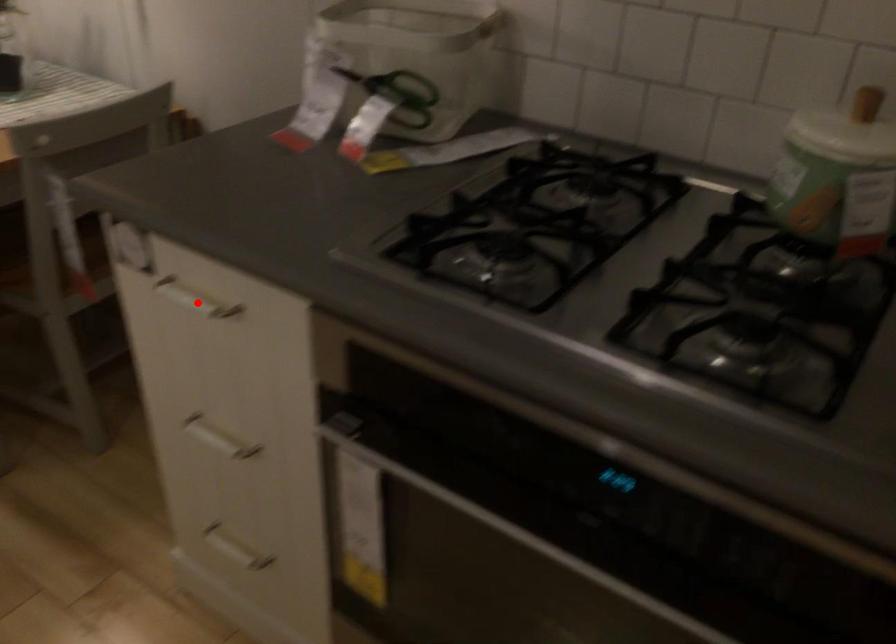
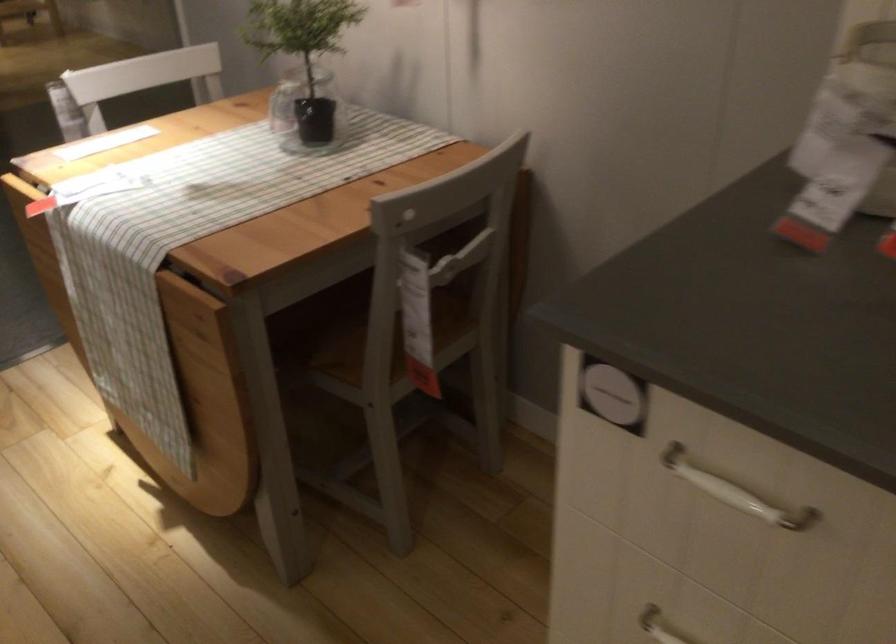
Question: I am providing you with two images of the same scene from different viewpoints. Image1 has a red point marked. In image2, the corresponding 3D location appears at what relative position? Reply with the corresponding letter.

Choices:
 (A) Closer
 (B) Farther

Answer: (A)